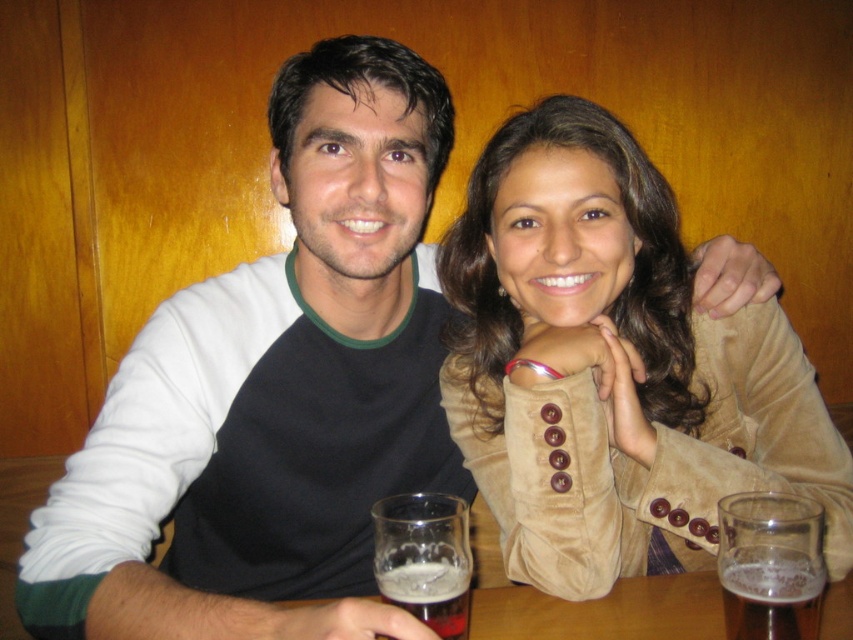
You are a waiter in a restaurant and need to place a new drink order for the customer. The existing translucent glass at lower center is currently occupying space. Where should you place the new drink to avoid overlapping with the existing one?

The existing translucent glass at lower center is at point (424, 557). To avoid overlapping, place the new drink in an area not at that coordinate, such as the left side of the table or near the edge opposite the glass.

Looking at the scene, where is the clear glass beer at lower center in relation to the foamy amber liquid at lower center?

The clear glass beer at lower center is to the right of the foamy amber liquid at lower center.

You are a bartender preparing a drink for the couple at the table. The foamy amber liquid at lower center is their current drink. Where should you place the suede jacket at center to keep it from falling into the drink?

The suede jacket at center should be placed to the right side of the foamy amber liquid at lower center to keep it from falling into the drink, as it is already positioned on the right side of the foamy amber liquid at lower center.